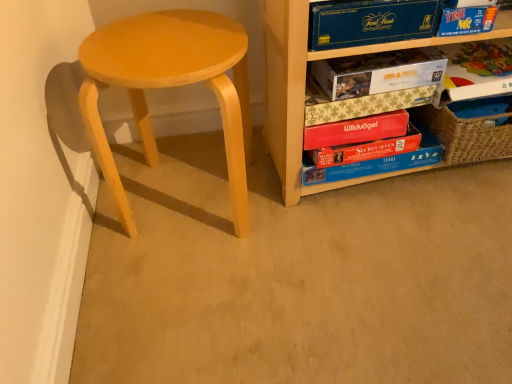
Question: Based on their positions, is blue cardboard book at upper right, which appears as the first paperback book when viewed from the top, located to the left or right of matte yellow stool at left?

Choices:
 (A) left
 (B) right

Answer: (B)

Question: From the image's perspective, is blue cardboard book at upper right, which appears as the first paperback book when viewed from the top, located above or below matte yellow stool at left?

Choices:
 (A) above
 (B) below

Answer: (A)

Question: Considering the real-world distances, which object is closest to the blue cardboard puzzle box at center, marked as the 7th paperback book in a top-to-bottom arrangement?

Choices:
 (A) matte yellow stool at left
 (B) matte cardboard puzzle box at center-right, which is the fourth paperback book from bottom to top
 (C) matte cardboard puzzle at upper center, which appears as the third paperback book when viewed from the top
 (D) red matte wildvögel book at center, the fifth paperback book in the top-to-bottom sequence
 (E) white paper at upper right, which is the 6th paperback book in bottom-to-top order

Answer: (D)

Question: Estimate the real-world distances between objects in this image. Which object is farther from the matte yellow stool at left?

Choices:
 (A) red matte wildvögel book at center, the fifth paperback book in the top-to-bottom sequence
 (B) blue cardboard book at upper right, which appears as the 7th paperback book when ordered from the bottom
 (C) blue cardboard puzzle box at center, placed as the first paperback book when sorted from bottom to top
 (D) red cardboard book at center, placed as the second paperback book when sorted from bottom to top
 (E) matte cardboard puzzle at upper center, which appears as the third paperback book when viewed from the top

Answer: (C)